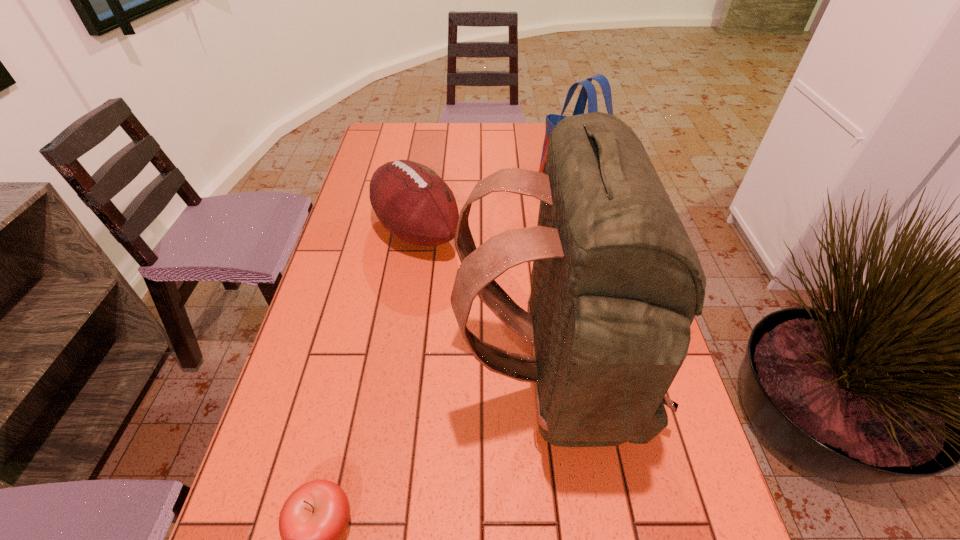
Find the location of a particular element. The width and height of the screenshot is (960, 540). backpack is located at coordinates (616, 282).

Locate an element on the screen. The width and height of the screenshot is (960, 540). the tallest object is located at coordinates (616, 282).

Where is `handbag`? The image size is (960, 540). handbag is located at coordinates (588, 91).

Locate an element on the screen. This screenshot has width=960, height=540. football (American) is located at coordinates (411, 201).

Locate an element on the screen. The height and width of the screenshot is (540, 960). free space located 0.240m on the back of the third farthest object is located at coordinates (346, 383).

You are a GUI agent. You are given a task and a screenshot of the screen. Output one action in this format:
    pyautogui.click(x=<x>, y=<y>)
    Task: Click on the vacant space located 0.170m on the back of the third farthest object
    The width and height of the screenshot is (960, 540).
    Given the screenshot: What is the action you would take?
    pyautogui.click(x=378, y=383)

Where is `vacant region located on the back of the third farthest object`? vacant region located on the back of the third farthest object is located at coordinates (378, 383).

This screenshot has height=540, width=960. In order to click on vacant space situated 0.140m on the back of the second tallest object in this screenshot , I will do `click(561, 155)`.

Image resolution: width=960 pixels, height=540 pixels. I want to click on blank area located on the back of the football (American), so click(x=423, y=192).

Where is `object that is at the left edge`? object that is at the left edge is located at coordinates (x=411, y=201).